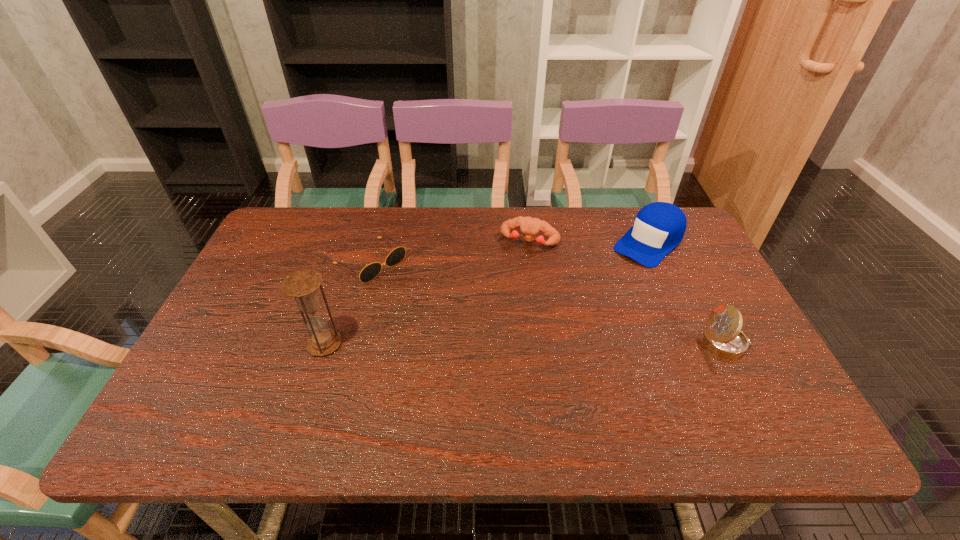
You are a GUI agent. You are given a task and a screenshot of the screen. Output one action in this format:
    pyautogui.click(x=<x>, y=<y>)
    Task: Click on the baseball cap that is positioned at the right edge
    Image resolution: width=960 pixels, height=540 pixels.
    Given the screenshot: What is the action you would take?
    pyautogui.click(x=659, y=227)

Where is `object located at the far right corner`? The width and height of the screenshot is (960, 540). object located at the far right corner is located at coordinates (659, 227).

Locate an element on the screen. The width and height of the screenshot is (960, 540). vacant space at the far edge is located at coordinates (497, 244).

You are a GUI agent. You are given a task and a screenshot of the screen. Output one action in this format:
    pyautogui.click(x=<x>, y=<y>)
    Task: Click on the free space at the near edge of the desktop
    
    Given the screenshot: What is the action you would take?
    pyautogui.click(x=643, y=386)

The image size is (960, 540). In order to click on vacant region at the right edge of the desktop in this screenshot , I will do `click(699, 345)`.

What are the coordinates of `vacant space at the far left corner` in the screenshot? It's located at 312,251.

The image size is (960, 540). I want to click on vacant space at the far right corner of the desktop, so click(x=636, y=215).

You are a GUI agent. You are given a task and a screenshot of the screen. Output one action in this format:
    pyautogui.click(x=<x>, y=<y>)
    Task: Click on the free area in between the sunglasses and the baseball cap
    
    Given the screenshot: What is the action you would take?
    pyautogui.click(x=510, y=252)

What are the coordinates of `free space between the compass and the hourglass` in the screenshot? It's located at (525, 344).

In order to click on free space between the sunglasses and the baseball cap in this screenshot , I will do `click(510, 252)`.